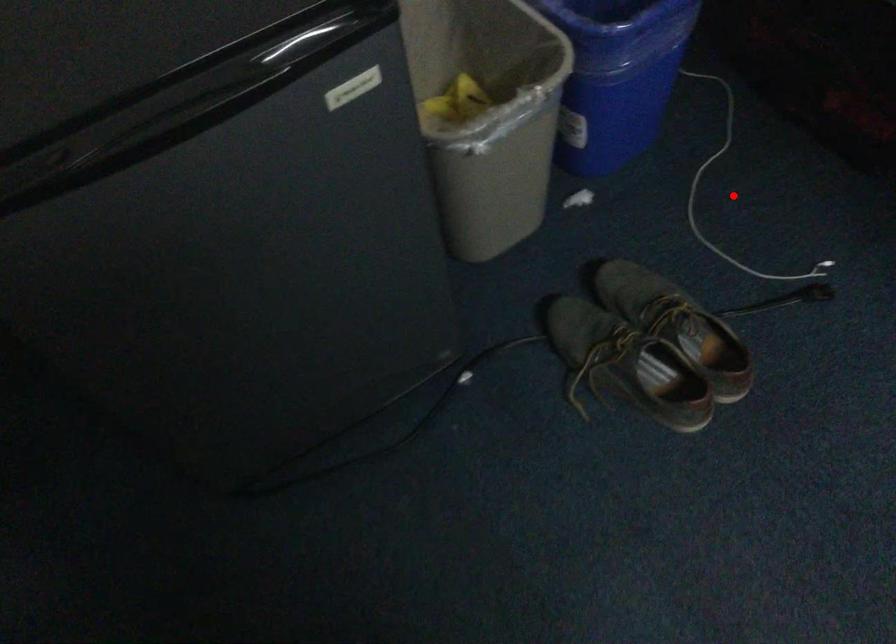
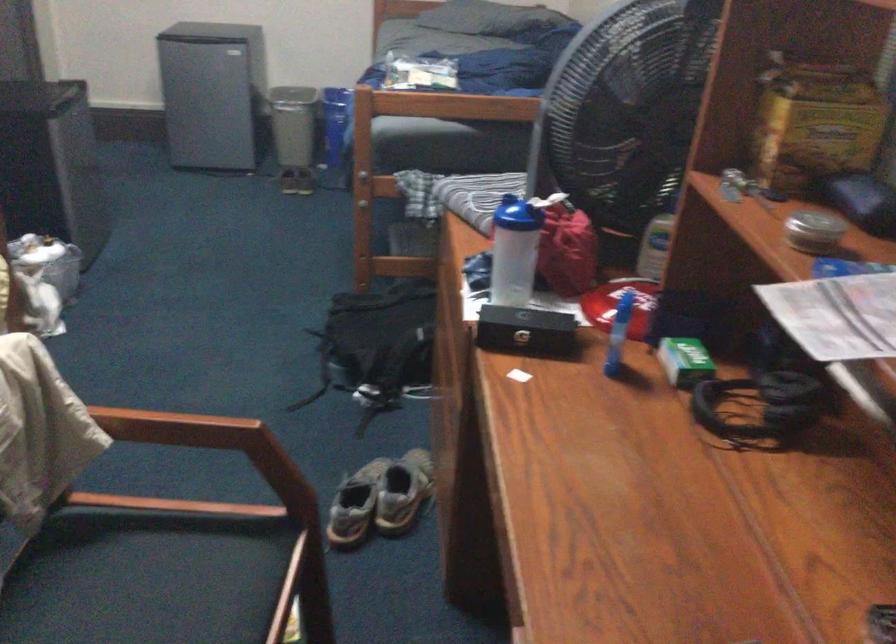
Question: I am providing you with two images of the same scene from different viewpoints. A red point is marked on the first image. At the location where the point appears in image 1, is it still visible in image 2?

Choices:
 (A) Yes
 (B) No

Answer: (B)